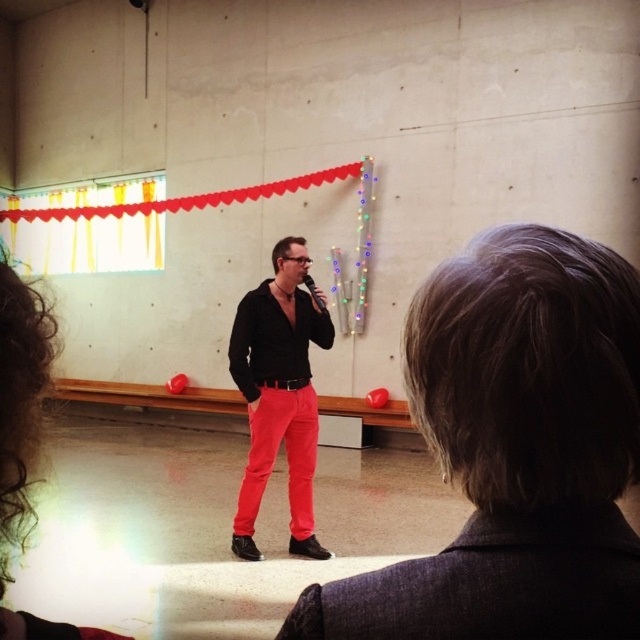
Question: Can you confirm if smooth gray hair at center is thinner than bright red cotton pants at center?

Choices:
 (A) no
 (B) yes

Answer: (B)

Question: Is smooth gray hair at center positioned at the back of matte black shirt at center?

Choices:
 (A) yes
 (B) no

Answer: (B)

Question: Estimate the real-world distances between objects in this image. Which object is closer to the smooth gray hair at center?

Choices:
 (A) bright red cotton pants at center
 (B) black matte microphone at center

Answer: (A)

Question: Which point appears closest to the camera in this image?

Choices:
 (A) (451, 618)
 (B) (291, 417)
 (C) (323, 307)
 (D) (312, 392)

Answer: (A)

Question: Can you confirm if matte black shirt at center is thinner than bright red cotton pants at center?

Choices:
 (A) no
 (B) yes

Answer: (A)

Question: Based on their relative distances, which object is nearer to the black matte microphone at center?

Choices:
 (A) matte black shirt at center
 (B) bright red cotton pants at center
 (C) smooth gray hair at center

Answer: (A)